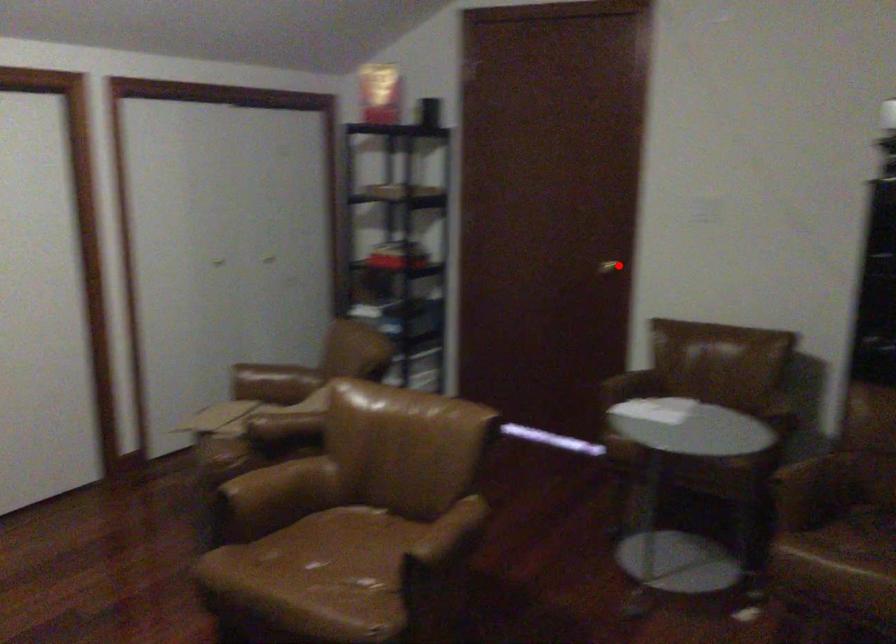
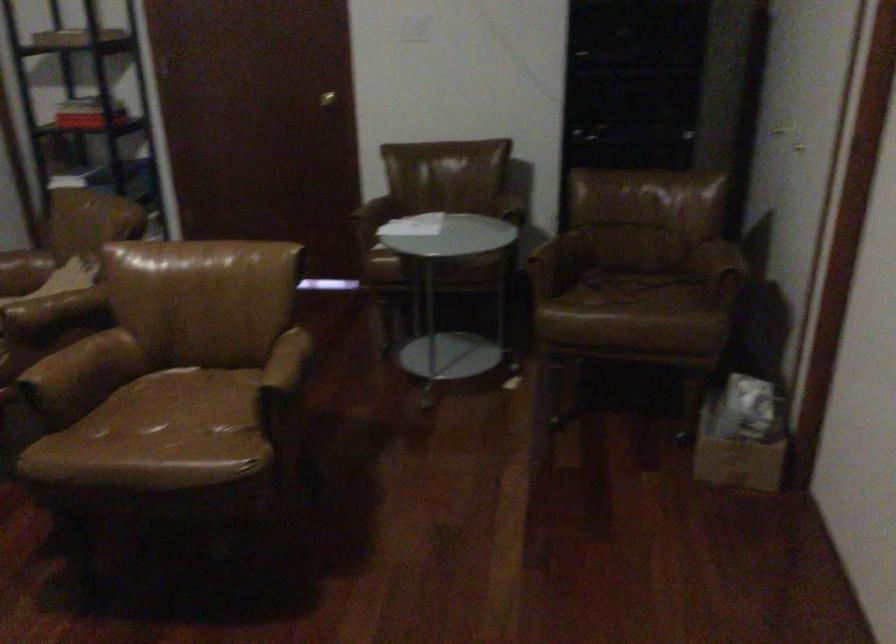
The point at the highlighted location is marked in the first image. Where is the corresponding point in the second image?

(326, 99)